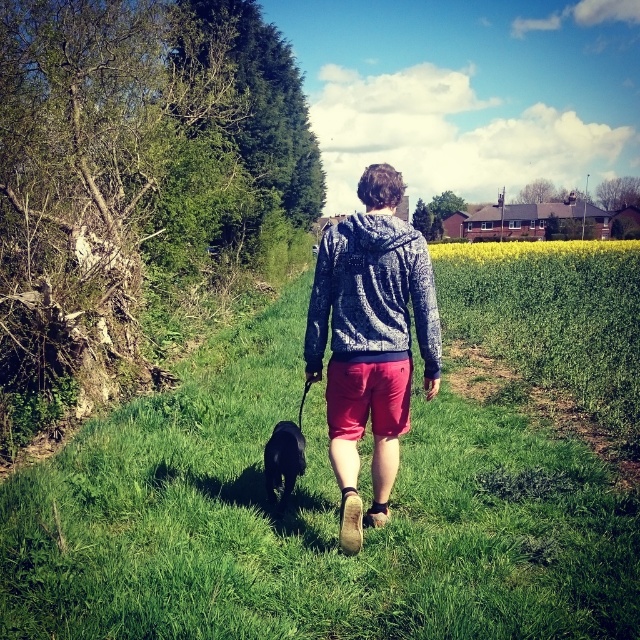
Question: Can you confirm if speckled hoodie at center is positioned below speckled fleece hoodie at center?

Choices:
 (A) no
 (B) yes

Answer: (B)

Question: Observing the image, what is the correct spatial positioning of speckled hoodie at center in reference to matte red shorts at center?

Choices:
 (A) right
 (B) left

Answer: (A)

Question: Can you confirm if green grassy at center is positioned to the right of black fur at center?

Choices:
 (A) no
 (B) yes

Answer: (B)

Question: Which object appears closest to the camera in this image?

Choices:
 (A) black fur at center
 (B) matte red shorts at center

Answer: (B)

Question: Considering the real-world distances, which object is farthest from the matte red shorts at center?

Choices:
 (A) black fur at center
 (B) speckled fleece hoodie at center

Answer: (A)

Question: Which point is farther to the camera?

Choices:
 (A) (385, 388)
 (B) (266, 481)
 (C) (468, 636)
 (D) (360, 340)

Answer: (B)